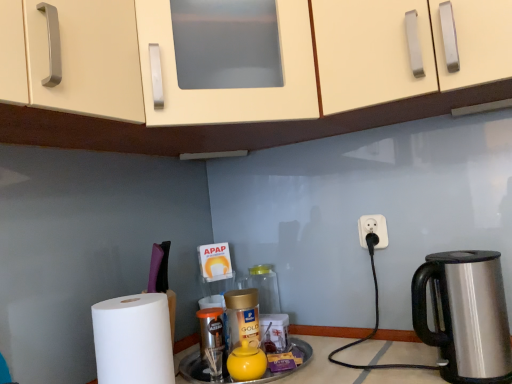
The height and width of the screenshot is (384, 512). I want to click on free point to the right of yellow matte tea pot at center, so click(296, 363).